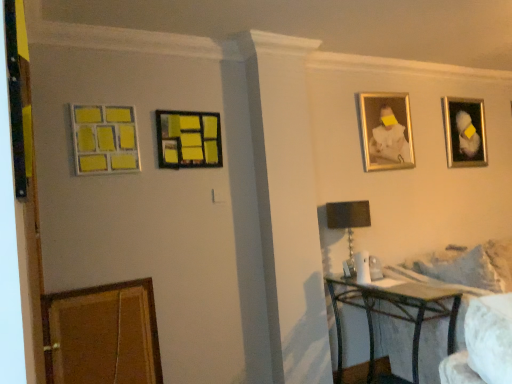
Question: Is white fabric couch at lower right in contact with matte plastic picture frame at center, acting as the third picture frame starting from the right?

Choices:
 (A) yes
 (B) no

Answer: (B)

Question: Is white fabric couch at lower right turned away from matte plastic picture frame at center, positioned as the 2th picture frame in front-to-back order?

Choices:
 (A) yes
 (B) no

Answer: (B)

Question: Is white fabric couch at lower right bigger than matte plastic picture frame at center, which is the third picture frame from back to front?

Choices:
 (A) no
 (B) yes

Answer: (B)

Question: Considering the relative positions of white fabric couch at lower right and matte plastic picture frame at center, which is the third picture frame from back to front, in the image provided, is white fabric couch at lower right to the left of matte plastic picture frame at center, which is the third picture frame from back to front, from the viewer's perspective?

Choices:
 (A) yes
 (B) no

Answer: (B)

Question: Is matte plastic picture frame at center, acting as the third picture frame starting from the right, inside white fabric couch at lower right?

Choices:
 (A) no
 (B) yes

Answer: (A)

Question: Is white fabric couch at lower right smaller than matte plastic picture frame at center, which is the 2th picture frame in left-to-right order?

Choices:
 (A) no
 (B) yes

Answer: (A)

Question: Does gold metallic picture frame at upper right, the 2th picture frame viewed from the right, have a greater width compared to matte plastic picture frame at center, positioned as the 2th picture frame in front-to-back order?

Choices:
 (A) yes
 (B) no

Answer: (A)

Question: Can matte plastic picture frame at center, which is the 2th picture frame in left-to-right order, be found inside gold metallic picture frame at upper right, the third picture frame in the left-to-right sequence?

Choices:
 (A) yes
 (B) no

Answer: (B)

Question: Considering the relative positions of gold metallic picture frame at upper right, the 2th picture frame when ordered from back to front, and matte plastic picture frame at center, acting as the third picture frame starting from the right, in the image provided, is gold metallic picture frame at upper right, the 2th picture frame when ordered from back to front, to the right of matte plastic picture frame at center, acting as the third picture frame starting from the right, from the viewer's perspective?

Choices:
 (A) yes
 (B) no

Answer: (A)

Question: Does gold metallic picture frame at upper right, the third picture frame in the left-to-right sequence, lie in front of matte plastic picture frame at center, positioned as the 2th picture frame in front-to-back order?

Choices:
 (A) yes
 (B) no

Answer: (B)

Question: From a real-world perspective, does gold metallic picture frame at upper right, the third picture frame positioned from the front, stand above matte plastic picture frame at center, which is the third picture frame from back to front?

Choices:
 (A) no
 (B) yes

Answer: (B)

Question: From the image's perspective, would you say gold metallic picture frame at upper right, the third picture frame positioned from the front, is shown under matte plastic picture frame at center, acting as the third picture frame starting from the right?

Choices:
 (A) yes
 (B) no

Answer: (B)

Question: Is metallic silver picture frame at upper right, the 1th picture frame positioned from the right, positioned with its back to yellow matte picture frame at upper left, marked as the first picture frame in a front-to-back arrangement?

Choices:
 (A) no
 (B) yes

Answer: (A)